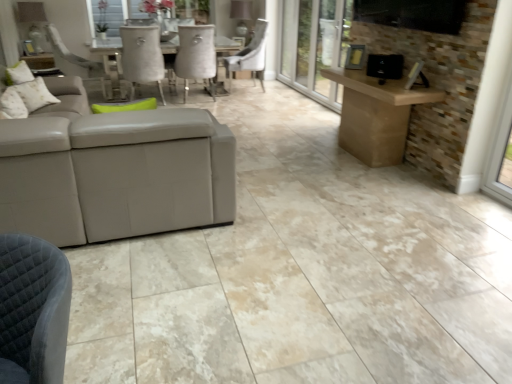
Question: Does white fabric pillow at upper left, which ranks as the 1th pillow in back-to-front order, have a larger size compared to suede-like beige chair at center, which is the first chair from left to right?

Choices:
 (A) yes
 (B) no

Answer: (B)

Question: Considering the relative positions of white fabric pillow at upper left, which is the 2th pillow from right to left, and suede-like beige chair at center, which is the first chair from left to right, in the image provided, is white fabric pillow at upper left, which is the 2th pillow from right to left, to the right of suede-like beige chair at center, which is the first chair from left to right, from the viewer's perspective?

Choices:
 (A) no
 (B) yes

Answer: (A)

Question: From a real-world perspective, is white fabric pillow at upper left, acting as the 1th pillow starting from the left, below suede-like beige chair at center, the second chair when ordered from right to left?

Choices:
 (A) no
 (B) yes

Answer: (A)

Question: Is white fabric pillow at upper left, which is the second pillow in front-to-back order, far away from suede-like beige chair at center, which is the first chair from left to right?

Choices:
 (A) no
 (B) yes

Answer: (B)

Question: Considering the relative positions of white fabric pillow at upper left, which is the second pillow in front-to-back order, and suede-like beige chair at center, which is the first chair from left to right, in the image provided, is white fabric pillow at upper left, which is the second pillow in front-to-back order, in front of suede-like beige chair at center, which is the first chair from left to right,?

Choices:
 (A) no
 (B) yes

Answer: (B)

Question: From the image's perspective, is white fabric pillow at upper left, acting as the 1th pillow starting from the left, located beneath suede-like beige chair at center, the second chair when ordered from right to left?

Choices:
 (A) no
 (B) yes

Answer: (B)

Question: Could you tell me if fluffy white pillow at upper left, the 2th pillow from the back, is turned towards white leather chair at center, which appears as the 1th chair when viewed from the right?

Choices:
 (A) no
 (B) yes

Answer: (A)

Question: Can you confirm if fluffy white pillow at upper left, acting as the 1th pillow starting from the front, is taller than white leather chair at center, which is the 2th chair in left-to-right order?

Choices:
 (A) yes
 (B) no

Answer: (B)

Question: Is fluffy white pillow at upper left, acting as the 1th pillow starting from the front, bigger than white leather chair at center, which is the 2th chair in left-to-right order?

Choices:
 (A) yes
 (B) no

Answer: (B)

Question: Is the position of fluffy white pillow at upper left, acting as the 1th pillow starting from the front, more distant than that of white leather chair at center, which appears as the 1th chair when viewed from the right?

Choices:
 (A) no
 (B) yes

Answer: (A)

Question: Is fluffy white pillow at upper left, arranged as the first pillow when viewed from the right, not close to white leather chair at center, which is the 2th chair in left-to-right order?

Choices:
 (A) yes
 (B) no

Answer: (A)

Question: Can we say fluffy white pillow at upper left, the 2th pillow from the back, lies outside white leather chair at center, which is the 2th chair in left-to-right order?

Choices:
 (A) no
 (B) yes

Answer: (B)

Question: From the image's perspective, does white leather chair at center, which is the 2th chair in left-to-right order, appear higher than transparent glass screen door at center?

Choices:
 (A) no
 (B) yes

Answer: (A)